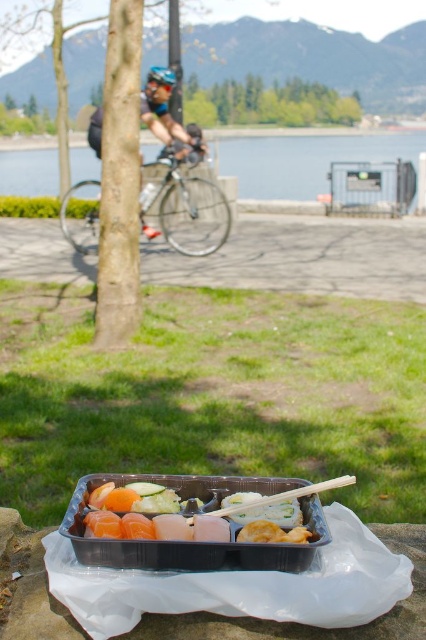
Question: Among these objects, which one is farthest from the camera?

Choices:
 (A) blue matte helmet at upper center
 (B) shiny metallic bicycle at center
 (C) white plastic chopstick at center
 (D) blue water at center

Answer: (D)

Question: Which of these objects is positioned closest to the blue matte helmet at upper center?

Choices:
 (A) shiny blue helmet at upper center
 (B) shiny metallic bicycle at center
 (C) green leafy tree at upper center
 (D) blue water at center

Answer: (B)

Question: Does shiny plastic sushi tray at center appear under white plastic chopstick at center?

Choices:
 (A) yes
 (B) no

Answer: (A)

Question: Considering the relative positions of shiny metallic bicycle at center and shiny plastic sushi tray at center in the image provided, where is shiny metallic bicycle at center located with respect to shiny plastic sushi tray at center?

Choices:
 (A) below
 (B) above

Answer: (B)

Question: Considering the real-world distances, which object is farthest from the green leafy tree at upper center?

Choices:
 (A) white plastic chopstick at center
 (B) shiny plastic sushi tray at center
 (C) shiny metallic bicycle at center
 (D) shiny blue helmet at upper center

Answer: (B)

Question: Can you confirm if blue water at center is wider than blue matte helmet at upper center?

Choices:
 (A) no
 (B) yes

Answer: (B)